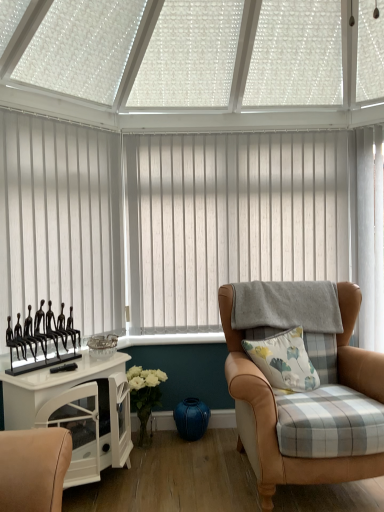
Question: Do you think white vertical blinds at left, which appears as the first window blind when viewed from the front, is within white glossy cabinet at left, or outside of it?

Choices:
 (A) outside
 (B) inside

Answer: (A)

Question: Based on their sizes in the image, would you say white vertical blinds at left, which is the 2th window blind from back to front, is bigger or smaller than white glossy cabinet at left?

Choices:
 (A) big
 (B) small

Answer: (B)

Question: Considering the real-world distances, which object is closest to the white vertical blinds at left, which is counted as the 1th window blind, starting from the left?

Choices:
 (A) white vertical blinds at center, marked as the first window blind in a right-to-left arrangement
 (B) leather armchair at right
 (C) white floral-patterned cushion at center-right
 (D) black metal figurines at left
 (E) white glossy cabinet at left

Answer: (D)

Question: Which object is positioned farthest from the black metal figurines at left?

Choices:
 (A) white vertical blinds at left, arranged as the second window blind when viewed from the right
 (B) white floral-patterned cushion at center-right
 (C) white glossy cabinet at left
 (D) white vertical blinds at center, the 2th window blind positioned from the front
 (E) leather armchair at right

Answer: (D)